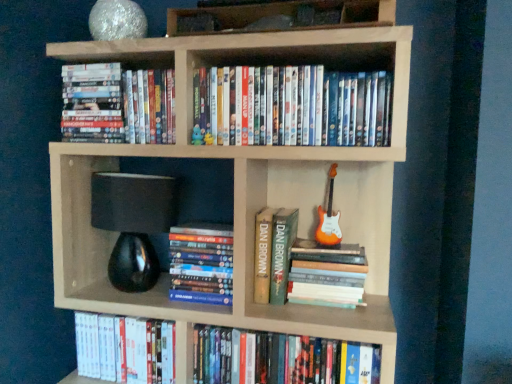
Question: From their relative heights in the image, would you say white glossy dvds at upper left, positioned as the 7th book in bottom-to-top order, is taller or shorter than hardcover books at center, positioned as the fourth book in bottom-to-top order?

Choices:
 (A) short
 (B) tall

Answer: (A)

Question: From the image's perspective, is white glossy dvds at upper left, positioned as the 1th book in top-to-bottom order, located above or below hardcover books at center, positioned as the fourth book in bottom-to-top order?

Choices:
 (A) above
 (B) below

Answer: (A)

Question: Based on their relative distances, which object is farther from the hardcover book at center, positioned as the third book in bottom-to-top order?

Choices:
 (A) white glossy dvd at lower left, which is counted as the second book, starting from the bottom
 (B) white glossy dvds at upper left, positioned as the 1th book in top-to-bottom order
 (C) hardcover book at lower center, which ranks as the seventh book in top-to-bottom order
 (D) wooden books at upper center
 (E) matte blue plush toy at upper center

Answer: (D)

Question: Considering the real-world distances, which object is closest to the white glossy dvds at upper left, positioned as the 7th book in bottom-to-top order?

Choices:
 (A) orange glossy electric guitar at right
 (B) natural wood bookcase at upper center
 (C) hardcover book at lower center, which ranks as the seventh book in top-to-bottom order
 (D) white glossy dvd at lower left, which appears as the 6th book when viewed from the top
 (E) matte plastic dvds at upper center, positioned as the second book in top-to-bottom order

Answer: (B)